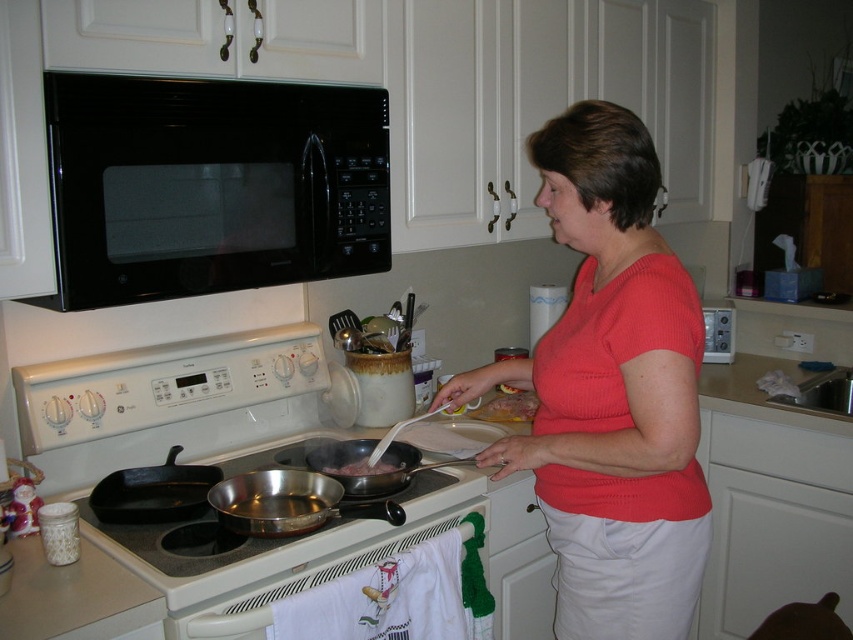
Question: In this image, where is silver metallic stove top at center located relative to dark brown meat at stove top?

Choices:
 (A) below
 (B) above

Answer: (A)

Question: Is the position of silver metallic stove top at center more distant than that of stainless steel wok at center?

Choices:
 (A) yes
 (B) no

Answer: (B)

Question: Can you confirm if knitted red sweater at center is bigger than black glass microwave at upper center?

Choices:
 (A) yes
 (B) no

Answer: (A)

Question: Considering the real-world distances, which object is closest to the black cast iron skillet at stove front?

Choices:
 (A) black glass microwave at upper center
 (B) dark brown meat at stove top
 (C) stainless steel pan at lower center

Answer: (B)

Question: Which point is farther to the camera?

Choices:
 (A) stainless steel pan at lower center
 (B) silver metallic stove top at center
 (C) dark brown meat at stove top

Answer: (C)

Question: Which object appears farthest from the camera in this image?

Choices:
 (A) stainless steel wok at center
 (B) silver metallic stove top at center
 (C) shiny silver wok at center
 (D) knitted red sweater at center

Answer: (C)